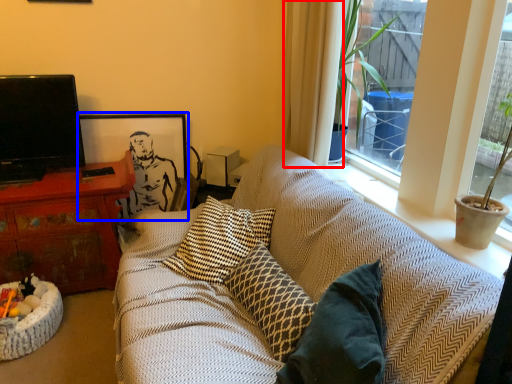
Question: Among these objects, which one is nearest to the camera, curtain (highlighted by a red box) or picture frame (highlighted by a blue box)?

Choices:
 (A) curtain
 (B) picture frame

Answer: (A)